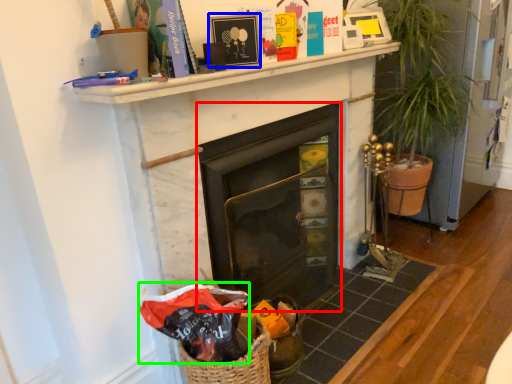
Question: Which is farther away from fireplace (highlighted by a red box)? picture frame (highlighted by a blue box) or gift bag (highlighted by a green box)?

Choices:
 (A) picture frame
 (B) gift bag

Answer: (A)